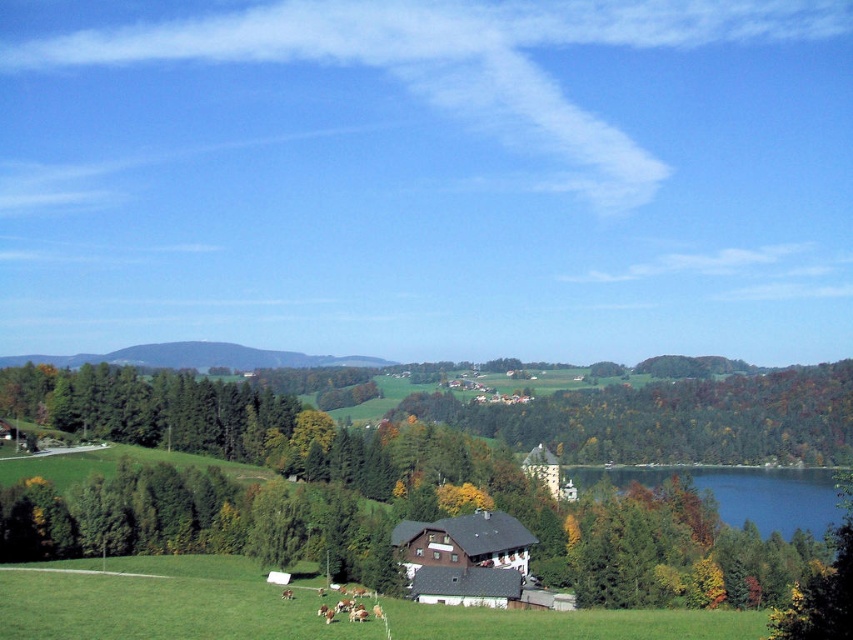
Question: Which point is farther to the camera?

Choices:
 (A) green matte tree at center
 (B) green grassy hillside at center

Answer: (B)

Question: Is green matte tree at center positioned before green grassy hillside at center?

Choices:
 (A) yes
 (B) no

Answer: (A)

Question: Which point is closer to the camera?

Choices:
 (A) (55, 358)
 (B) (244, 408)

Answer: (B)

Question: Is green matte tree at center thinner than green grassy hillside at center?

Choices:
 (A) no
 (B) yes

Answer: (B)

Question: Can you confirm if green matte tree at center is smaller than green grassy hillside at center?

Choices:
 (A) no
 (B) yes

Answer: (A)